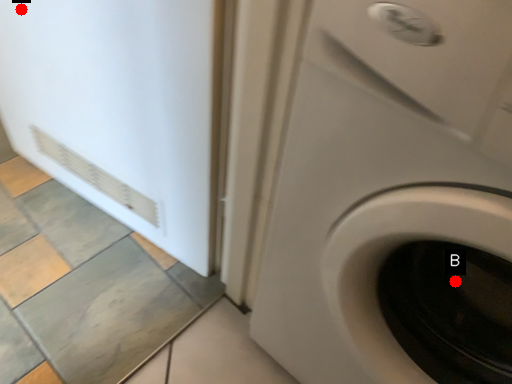
Question: Two points are circled on the image, labeled by A and B beside each circle. Which point is further to the camera?

Choices:
 (A) A is further
 (B) B is further

Answer: (B)